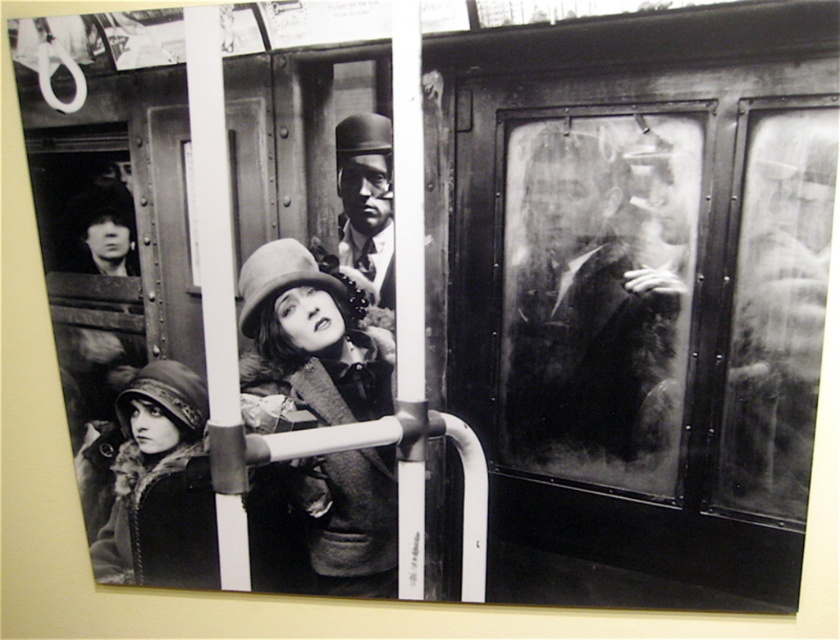
Question: Among these points, which one is farthest from the camera?

Choices:
 (A) (628, 236)
 (B) (344, 522)

Answer: (B)

Question: Does smooth black coat at right appear on the right side of fuzzy felt hat at center?

Choices:
 (A) yes
 (B) no

Answer: (A)

Question: Is smooth black coat at right positioned in front of fur-lined coat at lower left?

Choices:
 (A) yes
 (B) no

Answer: (A)

Question: Does smooth black coat at right appear under fuzzy felt hat at center?

Choices:
 (A) no
 (B) yes

Answer: (A)

Question: Among these objects, which one is nearest to the camera?

Choices:
 (A) fuzzy felt hat at center
 (B) fur-lined coat at lower left
 (C) smooth black coat at right

Answer: (C)

Question: Which point is closer to the camera?

Choices:
 (A) (252, 403)
 (B) (156, 508)

Answer: (A)